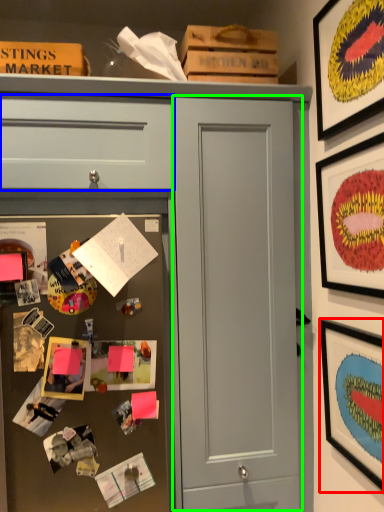
Question: Considering the real-world distances, which object is closest to picture frame (highlighted by a red box)? drawer (highlighted by a blue box) or door (highlighted by a green box).

Choices:
 (A) drawer
 (B) door

Answer: (B)